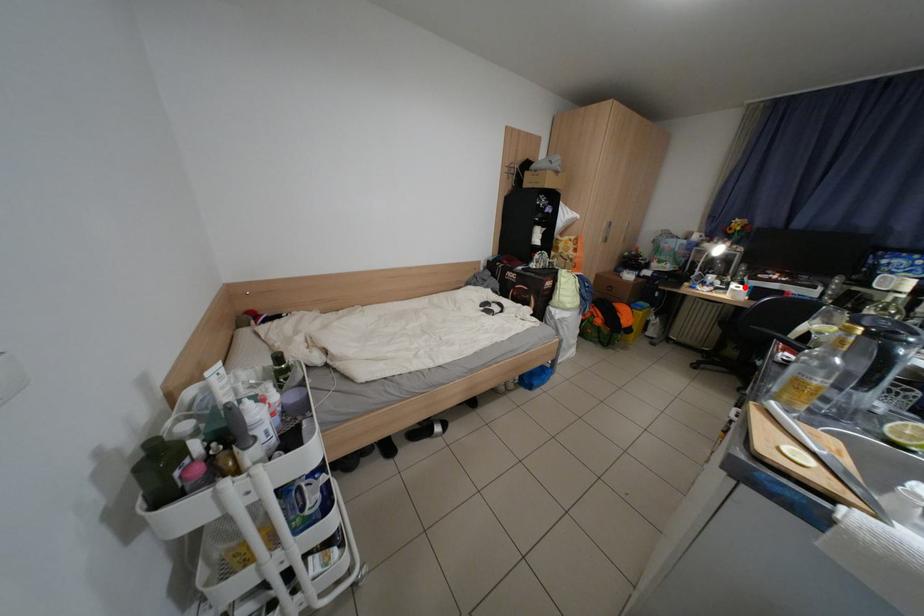
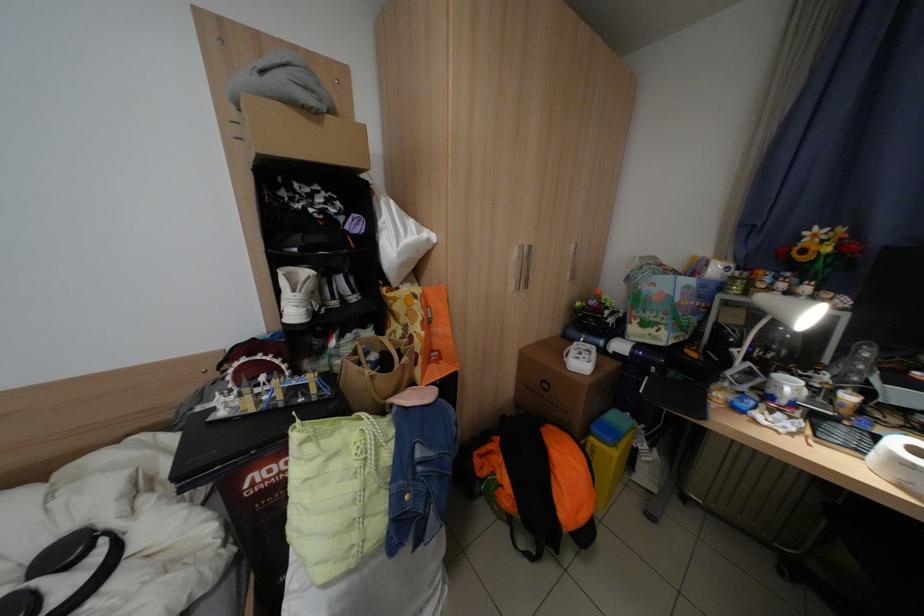
Locate, in the second image, the point that corresponds to the highlighted location in the first image.

(906, 442)